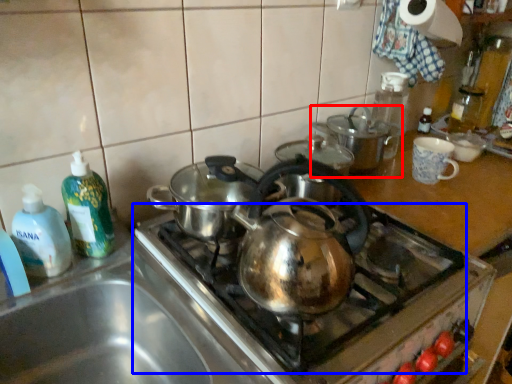
Question: Which object appears farthest to the camera in this image, kitchen appliance (highlighted by a red box) or gas stove (highlighted by a blue box)?

Choices:
 (A) kitchen appliance
 (B) gas stove

Answer: (A)